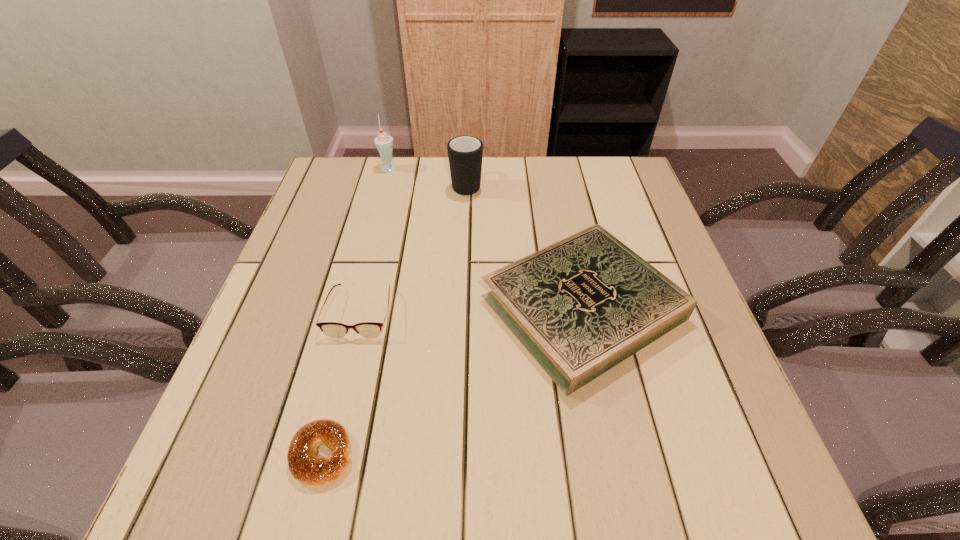
Where is `vacant point located 0.160m on the back of the hardback book`? vacant point located 0.160m on the back of the hardback book is located at coordinates (561, 204).

Where is `vacant space located on the face of the fourth tallest object`? Image resolution: width=960 pixels, height=540 pixels. vacant space located on the face of the fourth tallest object is located at coordinates (318, 487).

I want to click on vacant space positioned on the right of the shortest object, so click(x=541, y=455).

The height and width of the screenshot is (540, 960). Identify the location of milkshake at the far edge. (384, 143).

This screenshot has width=960, height=540. In order to click on mug at the far edge in this screenshot , I will do `click(465, 153)`.

At what (x,y) coordinates should I click in order to perform the action: click on object that is at the near edge. Please return your answer as a coordinate pair (x, y). Looking at the image, I should click on (306, 466).

At what (x,y) coordinates should I click in order to perform the action: click on milkshake situated at the left edge. Please return your answer as a coordinate pair (x, y). The height and width of the screenshot is (540, 960). Looking at the image, I should click on (384, 143).

Find the location of a particular element. Image resolution: width=960 pixels, height=540 pixels. spectacles present at the left edge is located at coordinates (332, 329).

Locate an element on the screen. bagel at the left edge is located at coordinates tap(306, 466).

Find the location of a particular element. object that is at the right edge is located at coordinates (581, 306).